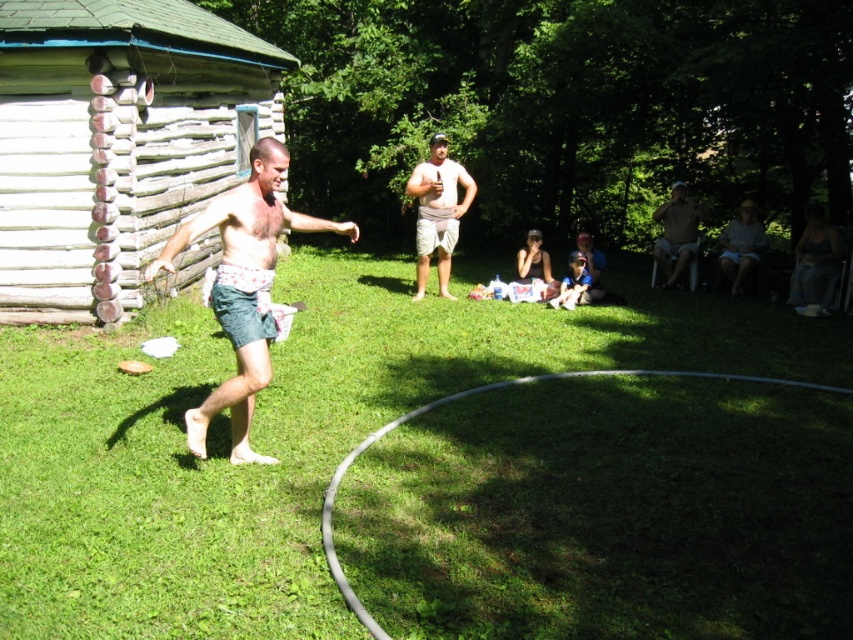
Question: Does weathered wood log cabin at left have a larger size compared to matte brown shirt at right?

Choices:
 (A) no
 (B) yes

Answer: (B)

Question: Which object is the closest to the weathered wood log cabin at left?

Choices:
 (A) matte black tank top at center
 (B) matte brown shirt at right

Answer: (A)

Question: Does green grass at center have a greater width compared to matte brown shirt at right?

Choices:
 (A) no
 (B) yes

Answer: (A)

Question: Which of the following is the farthest from the observer?

Choices:
 (A) denim shorts at center
 (B) denim shorts at lower right

Answer: (B)

Question: Where is weathered wood log cabin at left located in relation to blue denim shorts at lower center in the image?

Choices:
 (A) below
 (B) above

Answer: (B)

Question: Which of these objects is positioned farthest from the denim shorts at center?

Choices:
 (A) matte brown shirt at right
 (B) weathered wood log cabin at left
 (C) green grass at center

Answer: (A)